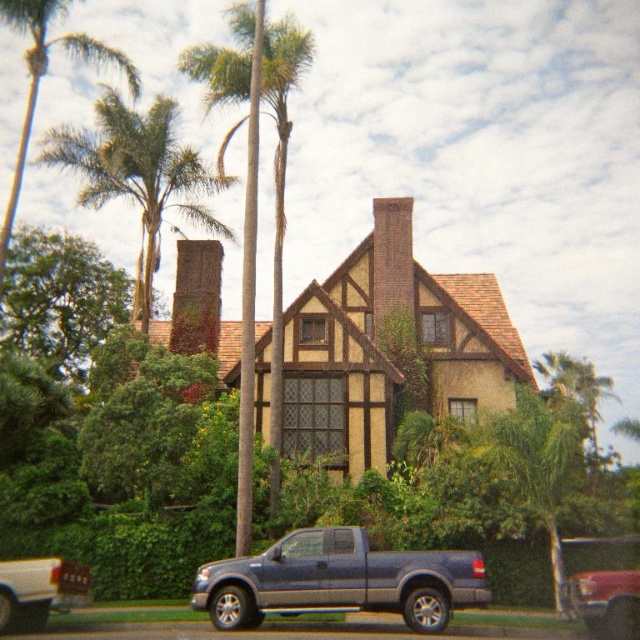
Question: Which of these objects is positioned farthest from the green leafy palm tree at upper left?

Choices:
 (A) metallic red truck at lower right
 (B) brick chimney at center
 (C) green leafy palm tree at center

Answer: (A)

Question: Which point is farther to the camera?

Choices:
 (A) metallic red truck at lower right
 (B) metallic gray truck at lower center
 (C) green leafy palm tree at center

Answer: (C)

Question: Is green leafy palm tree at upper center to the right of white matte truck at lower left from the viewer's perspective?

Choices:
 (A) yes
 (B) no

Answer: (B)

Question: Among these points, which one is nearest to the camera?

Choices:
 (A) (630, 572)
 (B) (376, 275)
 (C) (275, 260)

Answer: (A)

Question: Does green leafy palm tree at upper right come in front of metallic red truck at lower right?

Choices:
 (A) no
 (B) yes

Answer: (A)

Question: Can you confirm if green leafy palm tree at center is positioned above brick chimney at center?

Choices:
 (A) yes
 (B) no

Answer: (A)